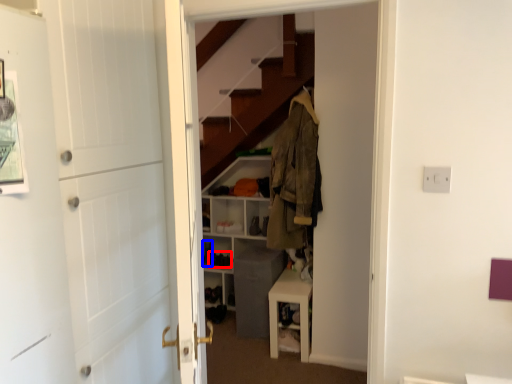
Question: Which object appears closest to the camera in this image, shoe (highlighted by a red box) or shoe (highlighted by a blue box)?

Choices:
 (A) shoe
 (B) shoe

Answer: (A)